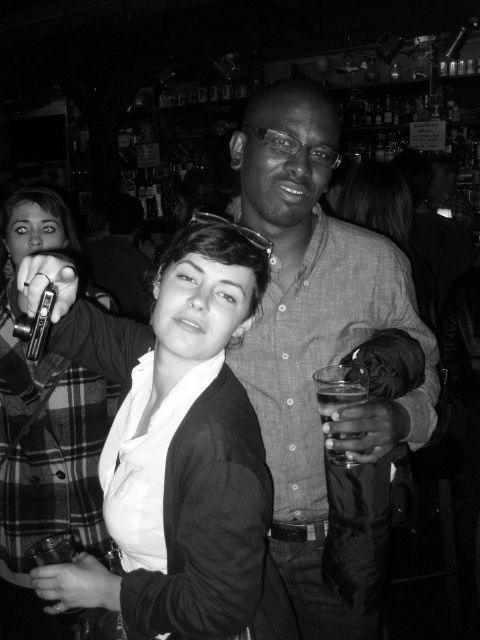
Question: Considering the relative positions of matte gray shirt at center and clear glass at right in the image provided, where is matte gray shirt at center located with respect to clear glass at right?

Choices:
 (A) below
 (B) above

Answer: (B)

Question: Based on their relative distances, which object is nearer to the matte black jacket at center?

Choices:
 (A) matte black blazer at center
 (B) plaid fabric jacket at left
 (C) matte gray shirt at center
 (D) clear glass at right

Answer: (C)

Question: Which point appears farthest from the camera in this image?

Choices:
 (A) (361, 164)
 (B) (348, 465)
 (C) (4, 234)

Answer: (A)

Question: Does matte black blazer at center have a greater width compared to clear glass at right?

Choices:
 (A) no
 (B) yes

Answer: (B)

Question: Does plaid fabric jacket at left have a larger size compared to clear glass at right?

Choices:
 (A) yes
 (B) no

Answer: (A)

Question: Which of these objects is positioned farthest from the clear glass at right?

Choices:
 (A) matte black jacket at center
 (B) matte black blazer at center

Answer: (B)